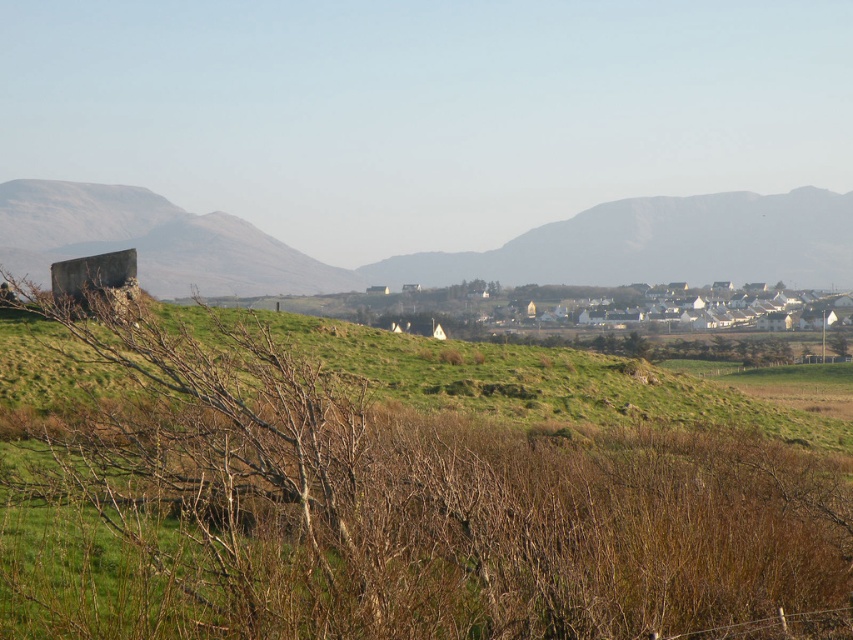
Question: Among these points, which one is nearest to the camera?

Choices:
 (A) tap(538, 400)
 (B) tap(807, 205)

Answer: (A)

Question: Which point is farther from the camera taking this photo?

Choices:
 (A) (532, 268)
 (B) (543, 500)
 (C) (65, 216)

Answer: (C)

Question: Which object appears closest to the camera in this image?

Choices:
 (A) gray rocky mountain at center
 (B) brown dry bush at left
 (C) smooth gray rock at left

Answer: (B)

Question: Does brown dry bush at left appear under gray rocky mountain at center?

Choices:
 (A) no
 (B) yes

Answer: (B)

Question: Is brown dry bush at left to the right of gray rocky mountain at center from the viewer's perspective?

Choices:
 (A) yes
 (B) no

Answer: (B)

Question: Is brown dry bush at left positioned behind smooth gray rock at left?

Choices:
 (A) yes
 (B) no

Answer: (B)